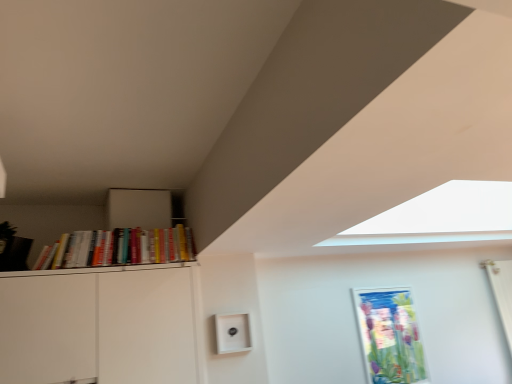
Locate an element on the screen. empty space that is ontop of metallic silver picture frame at center-right (from a real-world perspective) is located at coordinates (378, 285).